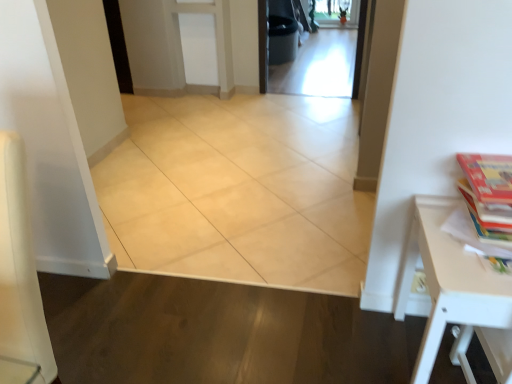
Question: Is point (471, 271) positioned closer to the camera than point (480, 165)?

Choices:
 (A) closer
 (B) farther

Answer: (A)

Question: Considering their positions, is white matte table at right located in front of or behind multicolored paper book at right?

Choices:
 (A) behind
 (B) front

Answer: (B)

Question: Which of these objects is positioned farthest from the beige ceramic tile at center?

Choices:
 (A) white matte table at right
 (B) multicolored paper book at right
 (C) transparent glass screen door at center

Answer: (C)

Question: Estimate the real-world distances between objects in this image. Which object is closer to the transparent glass screen door at center?

Choices:
 (A) white matte table at right
 (B) beige ceramic tile at center
 (C) multicolored paper book at right

Answer: (B)